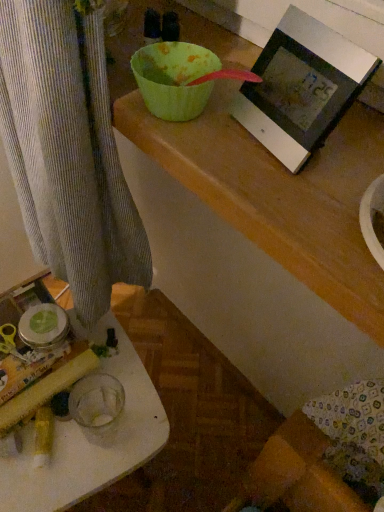
At what (x,y) coordinates should I click in order to perform the action: click on matte black picture frame at upper right. Please return your answer as a coordinate pair (x, y). This screenshot has width=384, height=512. Looking at the image, I should click on (301, 87).

This screenshot has height=512, width=384. Describe the element at coordinates (301, 87) in the screenshot. I see `matte black picture frame at upper right` at that location.

Describe the element at coordinates (89, 438) in the screenshot. This screenshot has width=384, height=512. I see `white plastic table at lower left` at that location.

This screenshot has width=384, height=512. I want to click on white plastic table at lower left, so click(89, 438).

Locate an element on the screen. matte black picture frame at upper right is located at coordinates (301, 87).

Based on their positions, is white plastic table at lower left located to the left or right of matte black picture frame at upper right?

From the image, it's evident that white plastic table at lower left is to the left of matte black picture frame at upper right.

Is the depth of white plastic table at lower left greater than that of matte black picture frame at upper right?

Yes, it is behind matte black picture frame at upper right.

Is point (82, 446) closer to viewer compared to point (277, 42)?

No, it is not.

From the image's perspective, does white plastic table at lower left appear lower than matte black picture frame at upper right?

Yes, from the image's perspective, white plastic table at lower left is below matte black picture frame at upper right.

From a real-world perspective, is white plastic table at lower left beneath matte black picture frame at upper right?

Yes, from a real-world perspective, white plastic table at lower left is beneath matte black picture frame at upper right.

Between white plastic table at lower left and matte black picture frame at upper right, which one has larger width?

white plastic table at lower left is wider.

Which of these two, white plastic table at lower left or matte black picture frame at upper right, stands taller?

white plastic table at lower left is taller.

Who is smaller, white plastic table at lower left or matte black picture frame at upper right?

Smaller between the two is matte black picture frame at upper right.

Would you say matte black picture frame at upper right is part of white plastic table at lower left's contents?

No, matte black picture frame at upper right is not surrounded by white plastic table at lower left.

Is white plastic table at lower left directly adjacent to matte black picture frame at upper right?

white plastic table at lower left and matte black picture frame at upper right are not in contact.

Is white plastic table at lower left facing towards matte black picture frame at upper right?

No, white plastic table at lower left is not oriented towards matte black picture frame at upper right.

How distant is white plastic table at lower left from matte black picture frame at upper right?

white plastic table at lower left and matte black picture frame at upper right are 22.22 inches apart from each other.

This screenshot has width=384, height=512. Identify the location of table directly beneath the matte black picture frame at upper right (from a real-world perspective). (89, 438).

Between matte black picture frame at upper right and white plastic table at lower left, which one appears on the left side from the viewer's perspective?

white plastic table at lower left is more to the left.

Does matte black picture frame at upper right lie in front of white plastic table at lower left?

Yes, matte black picture frame at upper right is closer to the viewer.

Considering the points (302, 27) and (90, 332), which point is behind, point (302, 27) or point (90, 332)?

The point (90, 332) is farther from the camera.

From the image's perspective, which one is positioned lower, matte black picture frame at upper right or white plastic table at lower left?

From the image's view, white plastic table at lower left is below.

From a real-world perspective, between matte black picture frame at upper right and white plastic table at lower left, who is vertically lower?

white plastic table at lower left is physically lower.

Does matte black picture frame at upper right have a lesser width compared to white plastic table at lower left?

Correct, the width of matte black picture frame at upper right is less than that of white plastic table at lower left.

Between matte black picture frame at upper right and white plastic table at lower left, which one has more height?

Standing taller between the two is white plastic table at lower left.

Considering the relative sizes of matte black picture frame at upper right and white plastic table at lower left in the image provided, is matte black picture frame at upper right bigger than white plastic table at lower left?

Actually, matte black picture frame at upper right might be smaller than white plastic table at lower left.

Is matte black picture frame at upper right spatially inside white plastic table at lower left, or outside of it?

matte black picture frame at upper right cannot be found inside white plastic table at lower left.

Is matte black picture frame at upper right far from white plastic table at lower left?

No, there isn't a large distance between matte black picture frame at upper right and white plastic table at lower left.

Could you tell me if matte black picture frame at upper right is turned towards white plastic table at lower left?

No, matte black picture frame at upper right is not facing towards white plastic table at lower left.

How many degrees apart are the facing directions of matte black picture frame at upper right and white plastic table at lower left?

The angle between the facing direction of matte black picture frame at upper right and the facing direction of white plastic table at lower left is 90.2 degrees.

Find the location of a particular element. Image resolution: width=384 pixels, height=512 pixels. picture frame that appears above the white plastic table at lower left (from a real-world perspective) is located at coordinates (301, 87).

The width and height of the screenshot is (384, 512). I want to click on picture frame above the white plastic table at lower left (from the image's perspective), so click(x=301, y=87).

At what (x,y) coordinates should I click in order to perform the action: click on picture frame that is on the right side of white plastic table at lower left. Please return your answer as a coordinate pair (x, y). This screenshot has height=512, width=384. Looking at the image, I should click on (301, 87).